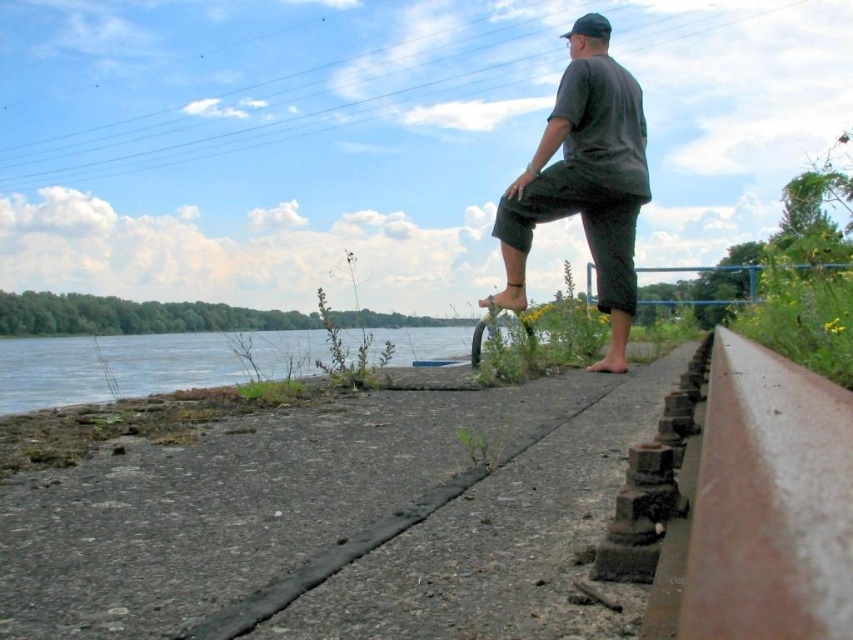
Does gray concrete pavement at center have a lesser height compared to dark gray fabric pants at center?

Yes, gray concrete pavement at center is shorter than dark gray fabric pants at center.

Does gray concrete pavement at center lie behind dark gray fabric pants at center?

No, gray concrete pavement at center is closer to the viewer.

Who is more distant from viewer, (515, 566) or (544, 205)?

The point (544, 205) is behind.

The image size is (853, 640). I want to click on gray concrete pavement at center, so click(340, 520).